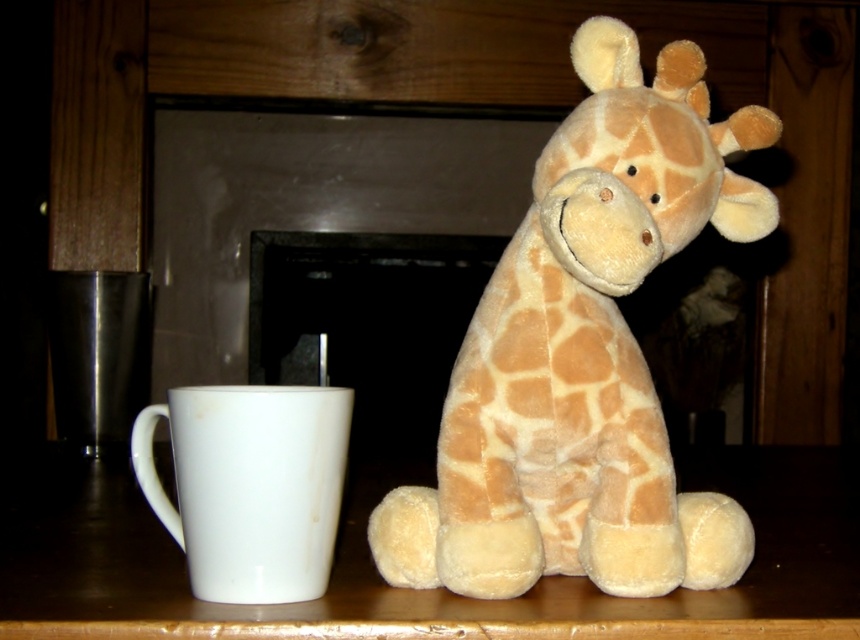
You have a small box that can only hold items smaller than the white glossy mug at left. You want to store the soft plush giraffe at center. Will it fit inside the box?

The soft plush giraffe at center is larger in size than the white glossy mug at left, so it will not fit inside the box designed for items smaller than the mug.

Where is the soft plush giraffe at center located in the image?

The soft plush giraffe at center is located at point (584, 355).

You are arranging items on a smooth wooden table at center. You have a white glossy mug at left that you want to place on the table. Based on the scene description, will the mug fit on the table?

The smooth wooden table at center is below the white glossy mug at left, so the mug is already placed on the table.